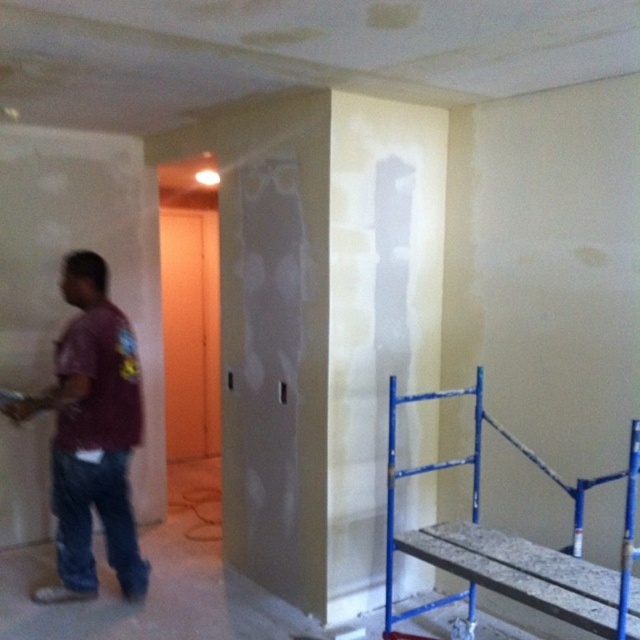
Is maroon fabric shirt at left closer to the viewer compared to blue metal scaffolding at lower right?

That is False.

Who is lower down, maroon fabric shirt at left or blue metal scaffolding at lower right?

blue metal scaffolding at lower right is lower down.

Does point (8, 417) come farther from viewer compared to point (403, 472)?

Yes, it is.

At what (x,y) coordinates should I click in order to perform the action: click on maroon fabric shirt at left. Please return your answer as a coordinate pair (x, y). This screenshot has height=640, width=640. Looking at the image, I should click on (92, 435).